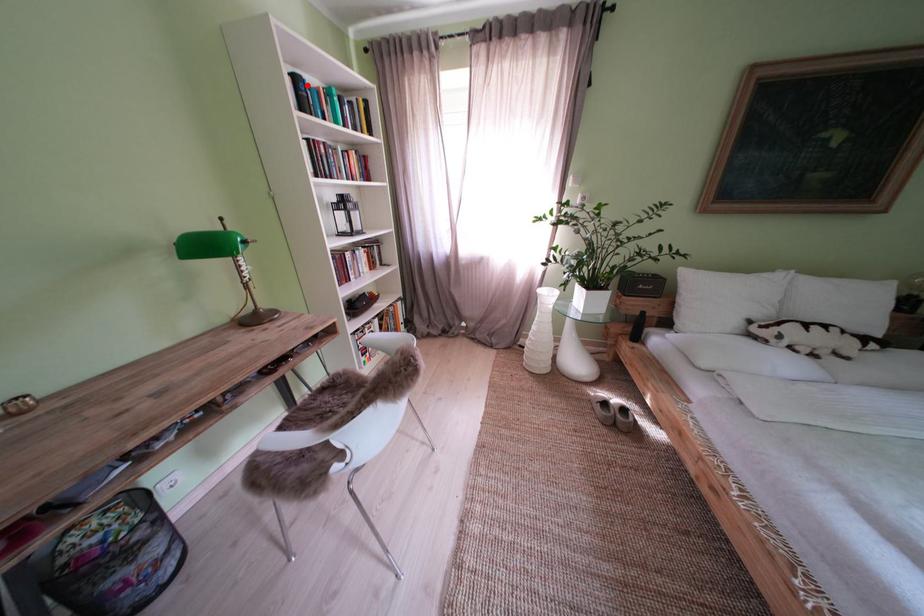
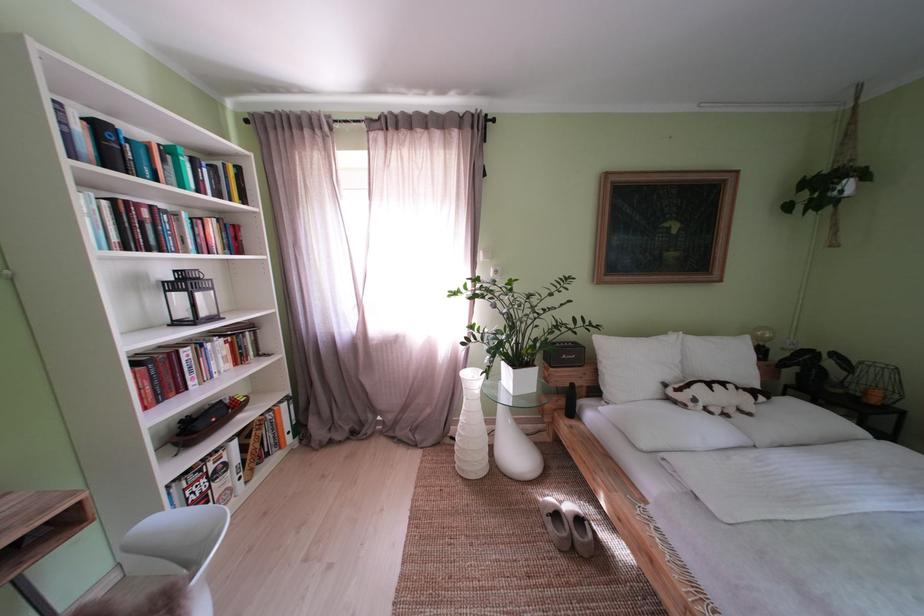
The point at the highlighted location is marked in the first image. Where is the corresponding point in the second image?

(111, 132)